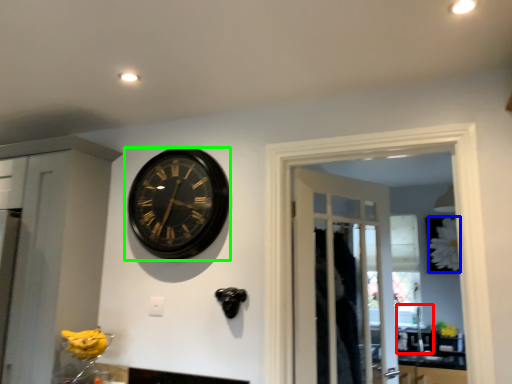
Question: Which object is the closest to the sink (highlighted by a red box)? Choose among these: flower (highlighted by a blue box) or wall clock (highlighted by a green box).

Choices:
 (A) flower
 (B) wall clock

Answer: (A)